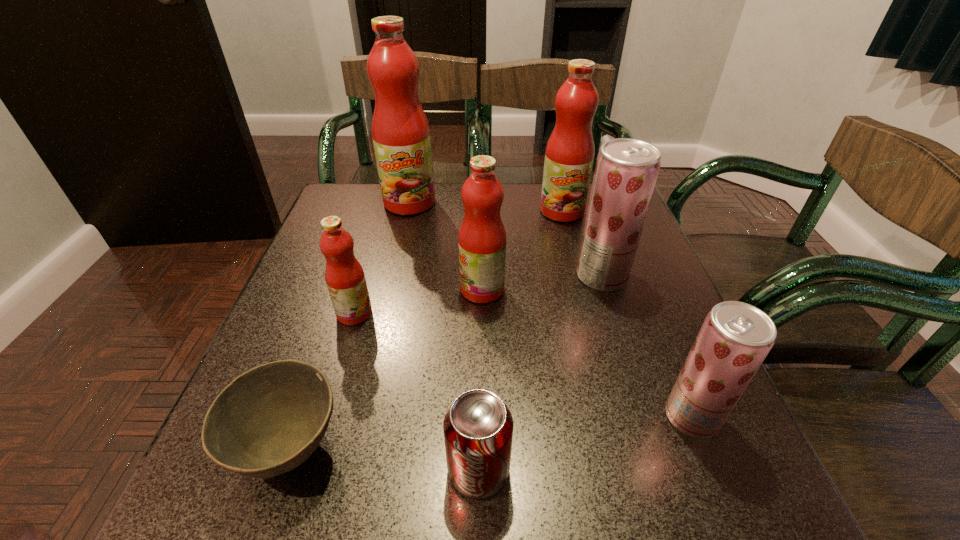
The width and height of the screenshot is (960, 540). I want to click on the biggest pink fruit juice, so click(401, 137).

At what (x,y) coordinates should I click in order to perform the action: click on the tallest fruit juice. Please return your answer as a coordinate pair (x, y). The width and height of the screenshot is (960, 540). Looking at the image, I should click on pyautogui.click(x=401, y=137).

Find the location of `the seventh shortest object`. the seventh shortest object is located at coordinates (569, 156).

Where is `the second tallest fruit juice`? This screenshot has height=540, width=960. the second tallest fruit juice is located at coordinates (569, 156).

Locate an element on the screen. Image resolution: width=960 pixels, height=540 pixels. the bigger strawberry fruit juice is located at coordinates (626, 171).

At what (x,y) coordinates should I click in order to perform the action: click on the third fruit juice from left to right. Please return your answer as a coordinate pair (x, y). The image size is (960, 540). Looking at the image, I should click on (482, 239).

The image size is (960, 540). Identify the location of the second smallest pink fruit juice. (482, 239).

At what (x,y) coordinates should I click in order to perform the action: click on the smallest pink fruit juice. Please return your answer as a coordinate pair (x, y). This screenshot has height=540, width=960. Looking at the image, I should click on (344, 275).

Image resolution: width=960 pixels, height=540 pixels. What are the coordinates of `the nearest fruit juice` in the screenshot? It's located at (735, 338).

Identify the location of the smaller strawberry fruit juice. (735, 338).